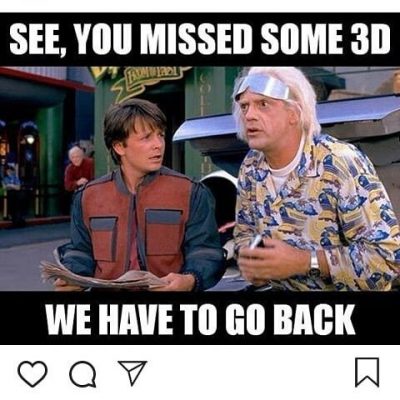
Where is `floor`? floor is located at coordinates (17, 262).